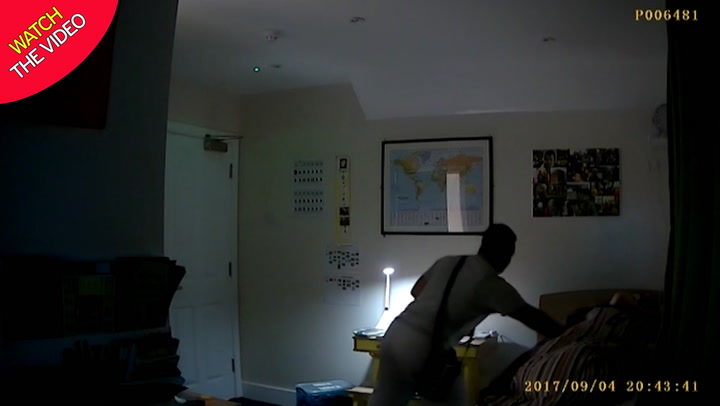
Where is `door hinges`? The image size is (720, 406). door hinges is located at coordinates (234, 367), (228, 271), (230, 171).